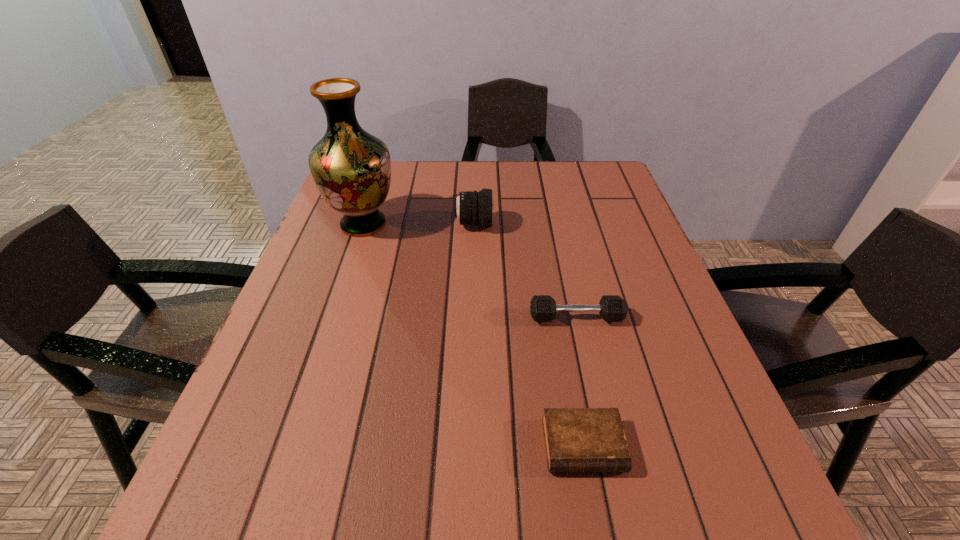
At what (x,y) coordinates should I click in order to perform the action: click on vase. Please return your answer as a coordinate pair (x, y). Looking at the image, I should click on (351, 168).

Where is `the leftmost object`? The width and height of the screenshot is (960, 540). the leftmost object is located at coordinates (351, 168).

Locate an element on the screen. Image resolution: width=960 pixels, height=540 pixels. telephoto lens is located at coordinates (471, 208).

Identify the location of the second object from left to right. (471, 208).

The height and width of the screenshot is (540, 960). I want to click on the third farthest object, so click(612, 308).

This screenshot has width=960, height=540. I want to click on dumbbell, so point(612,308).

The width and height of the screenshot is (960, 540). Find the location of `the shortest object`. the shortest object is located at coordinates (576, 439).

Locate an element on the screen. The width and height of the screenshot is (960, 540). diary is located at coordinates coord(576,439).

You are a GUI agent. You are given a task and a screenshot of the screen. Output one action in this format:
    pyautogui.click(x=<x>, y=<y>)
    Task: Click on the vacant space located 0.220m on the back of the tallest object
    The image size is (960, 540).
    Given the screenshot: What is the action you would take?
    pyautogui.click(x=383, y=167)

Locate an element on the screen. The height and width of the screenshot is (540, 960). free point located 0.210m at the front element of the third shortest object is located at coordinates (571, 225).